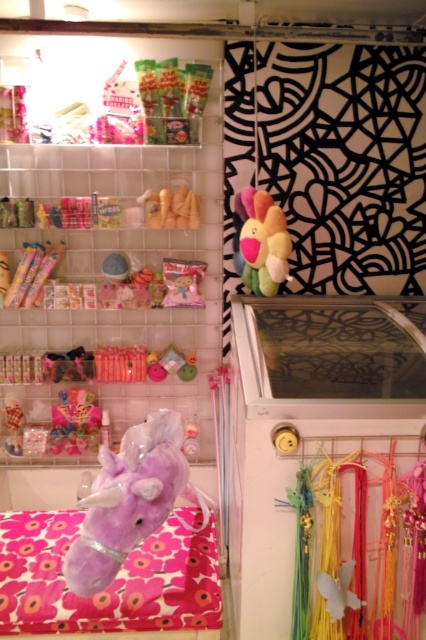
You are a customer in a gift shop looking to buy a plush toy. You see a purple plush unicorn at center and a soft plush toy at center. Which one is wider?

The purple plush unicorn at center is wider than the soft plush toy at center.

You are trying to reach the pink matte candy at upper left and the soft plush toy at center from your current position. Which item is taller?

The pink matte candy at upper left is taller than the soft plush toy at center.

You are a customer in the store and want to locate the pink matte candy at upper left. According to the store map coordinates, where exactly is it located?

The pink matte candy at upper left is located at point (x=126, y=259).